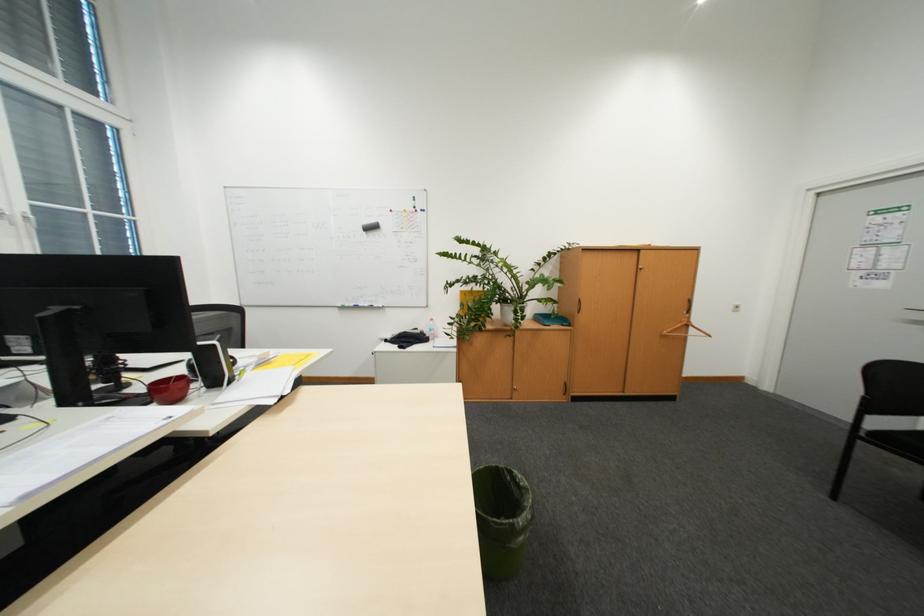
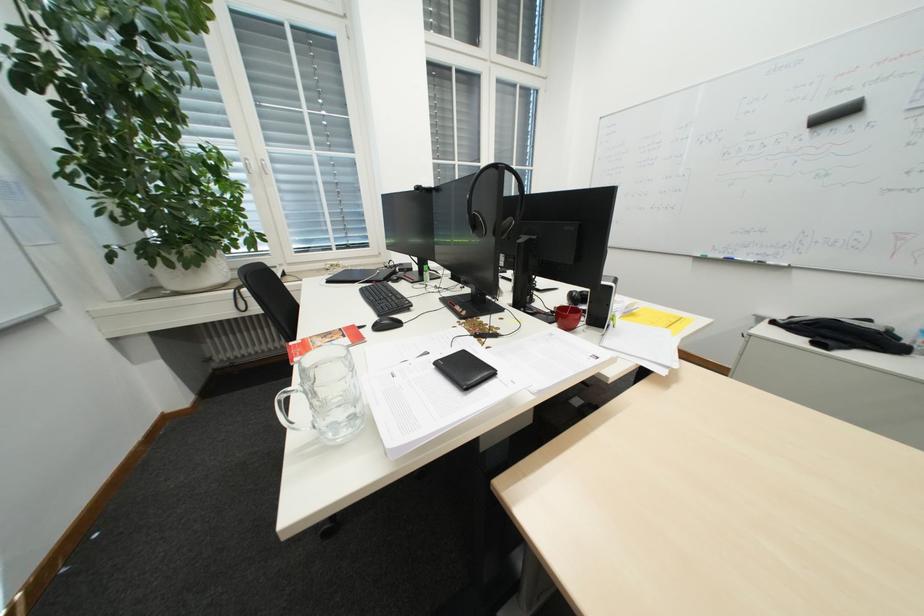
The images are taken continuously from a first-person perspective. In which direction is your viewpoint rotating?

The camera rotated toward left-down.